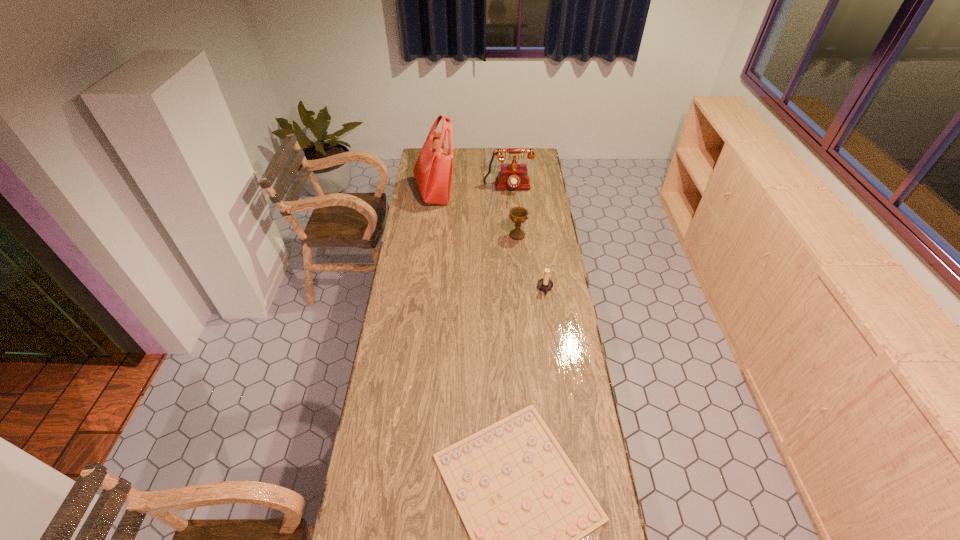
Image resolution: width=960 pixels, height=540 pixels. I want to click on handbag, so click(433, 171).

The image size is (960, 540). Identify the location of the fourth shortest object. (513, 176).

The image size is (960, 540). What are the coordinates of `chalice` in the screenshot? It's located at 518,215.

In order to click on the third farthest object in this screenshot , I will do `click(518, 215)`.

Locate an element on the screen. This screenshot has height=540, width=960. the fourth farthest object is located at coordinates (545, 284).

Image resolution: width=960 pixels, height=540 pixels. I want to click on candle holder, so click(545, 284).

Where is `vacant space located on the front-facing side of the handbag`? vacant space located on the front-facing side of the handbag is located at coordinates (518, 192).

I want to click on vacant area situated 0.170m on the dial of the second tallest object, so click(x=510, y=214).

This screenshot has height=540, width=960. Identify the location of free space located on the front of the third nearest object. (519, 260).

I want to click on vacant space located 0.240m on the wick of the candle holder, so click(x=483, y=289).